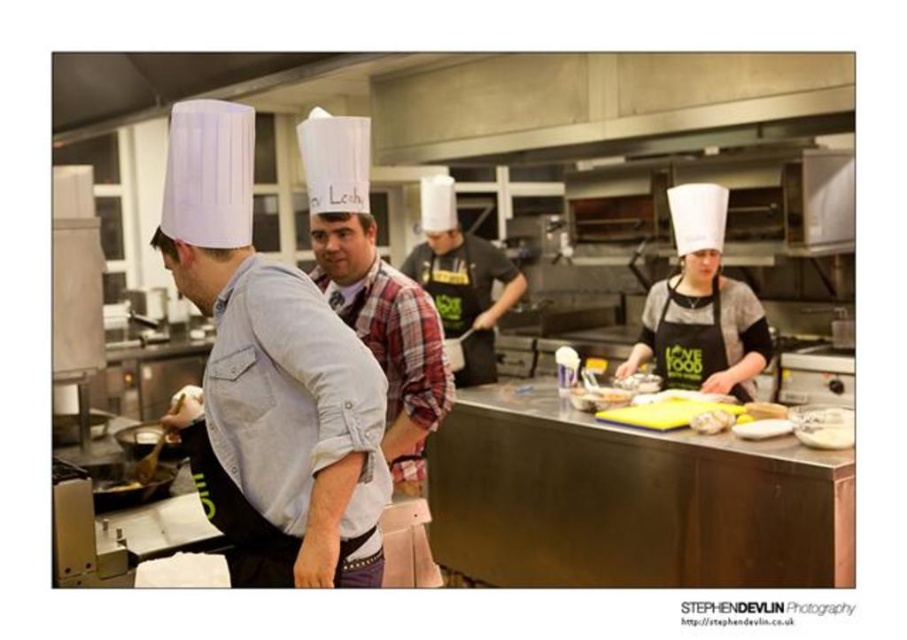
Question: Does black matte chef hat at center have a larger size compared to white creamy cheese at center?

Choices:
 (A) yes
 (B) no

Answer: (A)

Question: Estimate the real-world distances between objects in this image. Which object is farther from the yellow rubber gloves at center?

Choices:
 (A) black matte chef hat at center
 (B) white creamy cheese at center

Answer: (A)

Question: Is white creamy cheese at center further to the viewer compared to yellow rubber gloves at center?

Choices:
 (A) yes
 (B) no

Answer: (B)

Question: Which point appears closest to the camera in this image?

Choices:
 (A) (437, 180)
 (B) (769, 412)
 (C) (710, 422)

Answer: (C)

Question: Is black matte chef hat at center to the right of white creamy cheese at center from the viewer's perspective?

Choices:
 (A) no
 (B) yes

Answer: (A)

Question: Which of these objects is positioned closest to the yellow rubber gloves at center?

Choices:
 (A) white creamy cheese at center
 (B) black matte chef hat at center

Answer: (A)